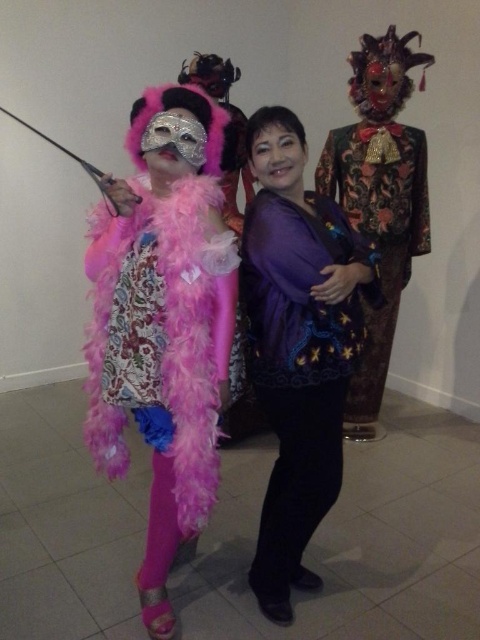
Can you confirm if fuzzy pink boa at center is thinner than purple satin blouse at center?

In fact, fuzzy pink boa at center might be wider than purple satin blouse at center.

Does fuzzy pink boa at center appear on the left side of purple satin blouse at center?

Indeed, fuzzy pink boa at center is positioned on the left side of purple satin blouse at center.

Identify the location of fuzzy pink boa at center. The image size is (480, 640). (163, 321).

Consider the image. Between purple satin blouse at center and velvet brocade robe at right, which one appears on the right side from the viewer's perspective?

Positioned to the right is velvet brocade robe at right.

The width and height of the screenshot is (480, 640). What are the coordinates of `purple satin blouse at center` in the screenshot? It's located at (297, 346).

Between fuzzy pink boa at center and velvet brocade robe at right, which one appears on the right side from the viewer's perspective?

Positioned to the right is velvet brocade robe at right.

Is fuzzy pink boa at center taller than velvet brocade robe at right?

Correct, fuzzy pink boa at center is much taller as velvet brocade robe at right.

This screenshot has height=640, width=480. I want to click on fuzzy pink boa at center, so pyautogui.click(x=163, y=321).